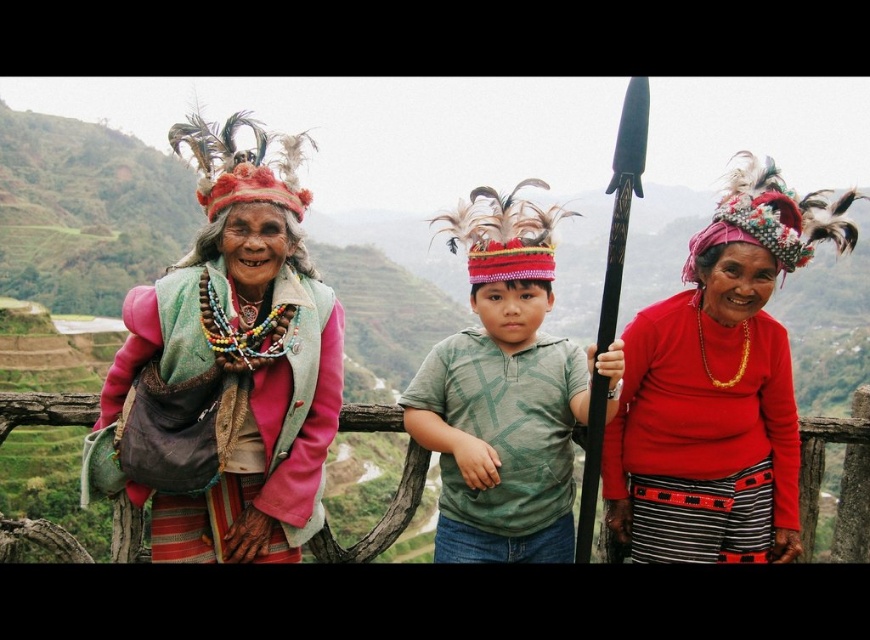
You are a photographer taking a picture of the scene described. You notice two points marked in the image. The first point is at coordinate point (780,246) and the second is at point (564,472). Which point is closer to your camera lens?

The point at coordinate point (780,246) is closer to the camera lens than point (564,472) according to the description.

In the scene described, the green cotton shirt at center and the multicolored beaded necklace at center are both visible. Which one is positioned more to the east? Please base your answer on their relative positions as described.

The green cotton shirt at center is to the right of multicolored beaded necklace at center, so if the scene is oriented with east to the right, the green cotton shirt at center would be more to the east.

You are a photographer trying to capture the multicolored beaded necklace at center and the matte red sweater at center in the same frame. Which object should you focus on first to ensure both are in the shot?

The multicolored beaded necklace at center should be focused on first since the matte red sweater at center is positioned to its right, allowing the photographer to adjust the frame to include both from the left starting point.